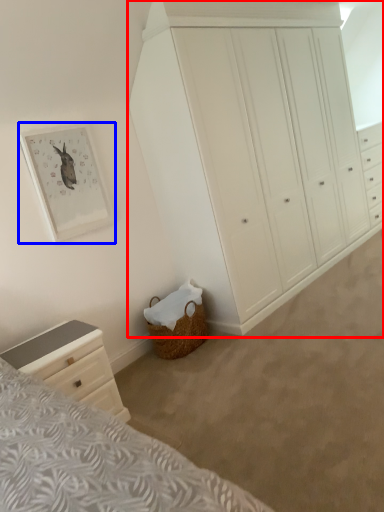
Question: Which point is closer to the camera, chest of drawers (highlighted by a red box) or picture frame (highlighted by a blue box)?

Choices:
 (A) chest of drawers
 (B) picture frame

Answer: (A)